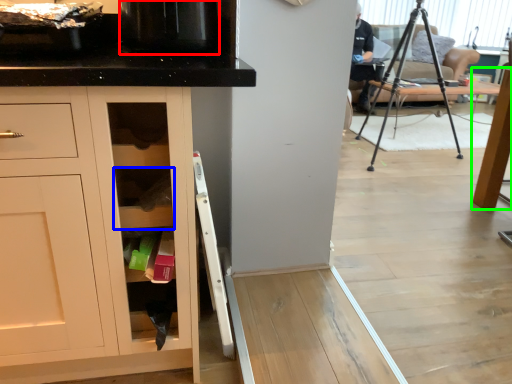
Question: Which object is the closest to the appliance (highlighted by a red box)? Choose among these: shelf (highlighted by a blue box) or table (highlighted by a green box).

Choices:
 (A) shelf
 (B) table

Answer: (A)